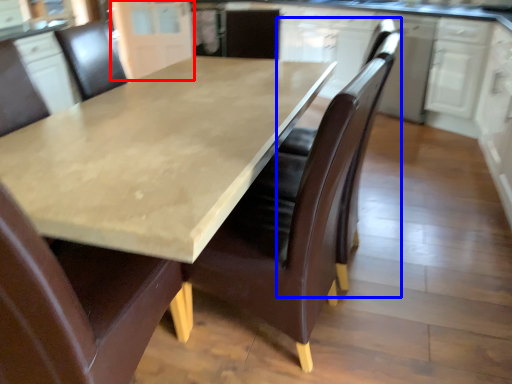
Question: Which object is further to the camera taking this photo, cabinetry (highlighted by a red box) or swivel chair (highlighted by a blue box)?

Choices:
 (A) cabinetry
 (B) swivel chair

Answer: (A)